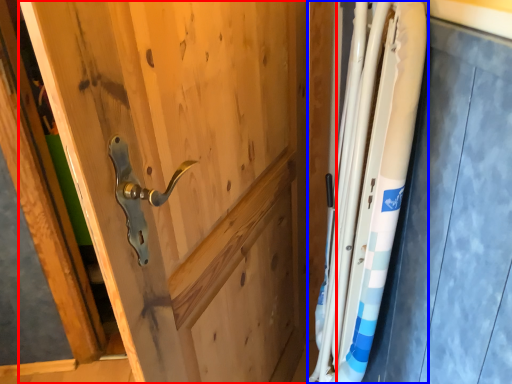
Question: Which object appears closest to the camera in this image, door (highlighted by a red box) or steel (highlighted by a blue box)?

Choices:
 (A) door
 (B) steel

Answer: (A)